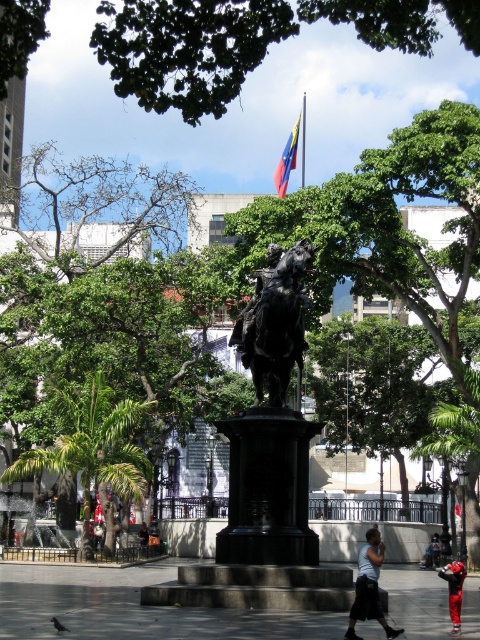
Can you confirm if black polished statue at center is smaller than green leafy tree at left?

Indeed, black polished statue at center has a smaller size compared to green leafy tree at left.

This screenshot has height=640, width=480. What do you see at coordinates (271, 433) in the screenshot?
I see `black polished statue at center` at bounding box center [271, 433].

Where is `black polished statue at center`? black polished statue at center is located at coordinates (271, 433).

Can you confirm if green leafy tree at center is thinner than red fabric pants at lower right?

No.

Is point (419, 188) closer to viewer compared to point (453, 564)?

No, it is not.

Between point (462, 156) and point (455, 620), which one is positioned behind?

Positioned behind is point (462, 156).

Identify the location of green leafy tree at center. (398, 221).

Consider the image. Does light blue t-shirt at lower right have a lesser width compared to red fabric pants at lower right?

Yes.

Which is behind, point (383, 620) or point (451, 563)?

Positioned behind is point (451, 563).

Where is `light blue t-shirt at lower right`? This screenshot has width=480, height=640. light blue t-shirt at lower right is located at coordinates (369, 586).